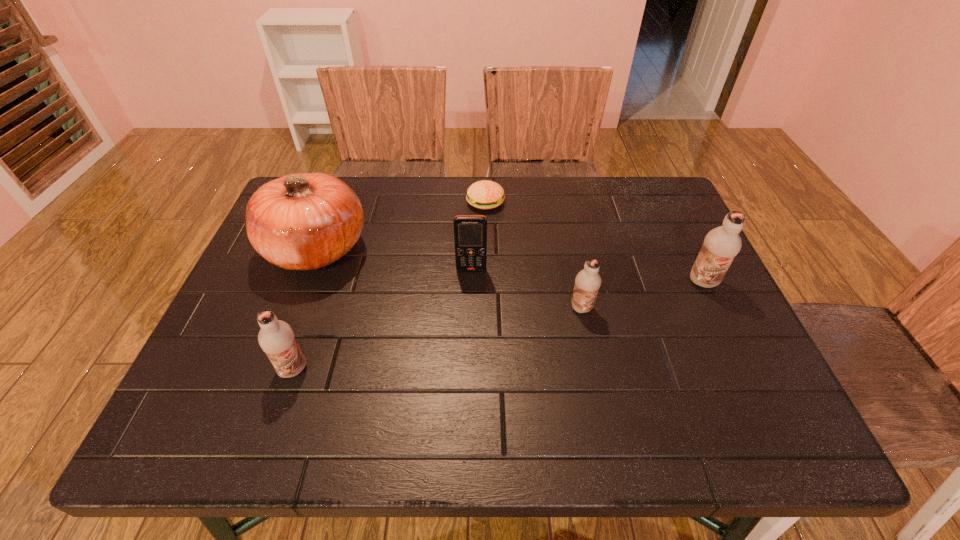
This screenshot has width=960, height=540. In order to click on free space located on the left of the nearest chocolate milk in this screenshot , I will do `click(228, 369)`.

Locate an element on the screen. free space located 0.200m on the back of the second nearest chocolate milk is located at coordinates (568, 242).

Find the location of a particular element. vacant space located on the back of the farthest chocolate milk is located at coordinates (683, 239).

Where is `vacant space located 0.270m on the left of the patty`? This screenshot has height=540, width=960. vacant space located 0.270m on the left of the patty is located at coordinates (374, 202).

You are a GUI agent. You are given a task and a screenshot of the screen. Output one action in this format:
    pyautogui.click(x=<x>, y=<y>)
    Task: Click on the vacant space located 0.260m on the front of the pumpkin
    The width and height of the screenshot is (960, 540).
    Given the screenshot: What is the action you would take?
    coord(266,382)

At what (x,y) coordinates should I click in order to perform the action: click on free space located 0.080m on the screen of the cellular telephone. Please return your answer as a coordinate pair (x, y). This screenshot has height=540, width=960. Looking at the image, I should click on click(470, 296).

Locate an element on the screen. This screenshot has width=960, height=540. patty that is positioned at the far edge is located at coordinates [x=485, y=194].

Locate an element on the screen. This screenshot has width=960, height=540. pumpkin at the far edge is located at coordinates (306, 221).

I want to click on object that is positioned at the near edge, so click(x=276, y=338).

Where is `chocolate milk that is at the left edge`? This screenshot has width=960, height=540. chocolate milk that is at the left edge is located at coordinates (276, 338).